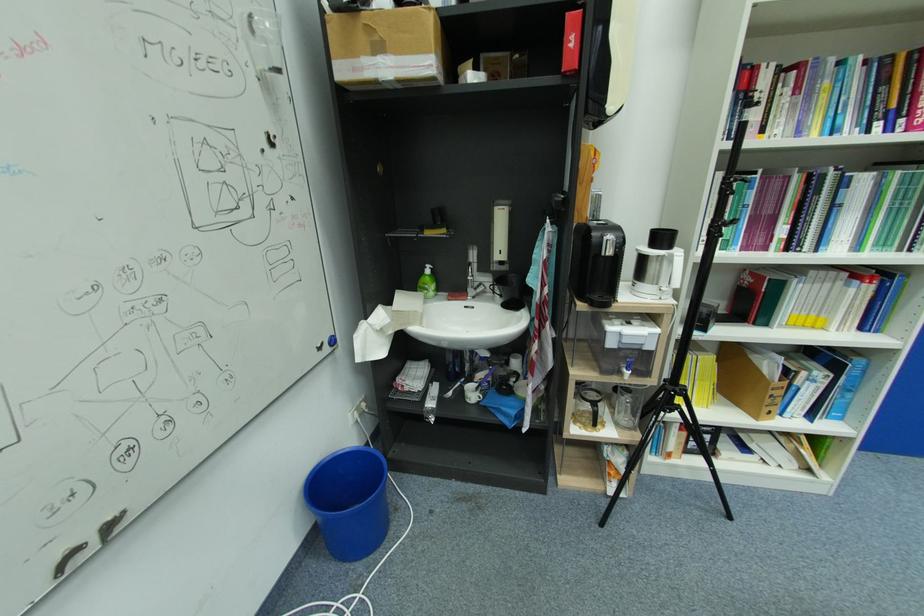
Where is `faucet handle`? The height and width of the screenshot is (616, 924). faucet handle is located at coordinates (477, 289).